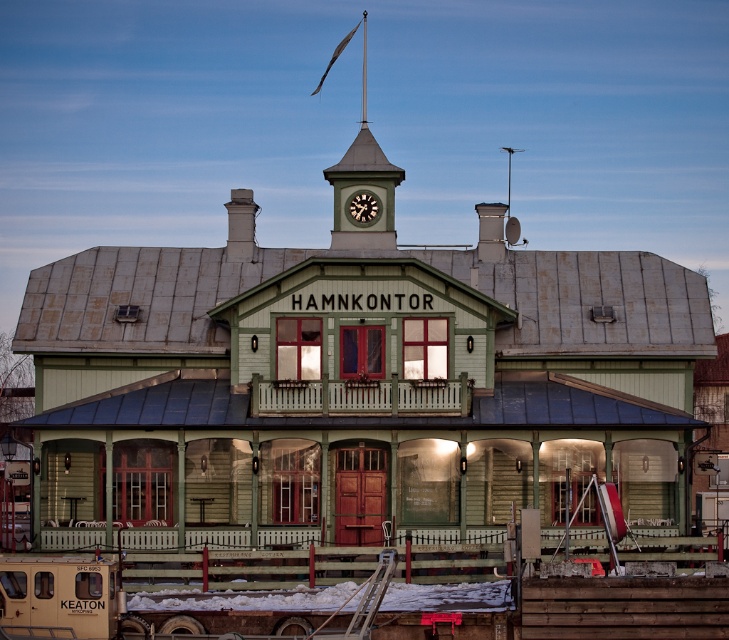
Question: Where is metallic spire at upper center located in relation to matte black clock at upper center in the image?

Choices:
 (A) below
 (B) above

Answer: (B)

Question: Where is metallic spire at upper center located in relation to matte black clock at upper center in the image?

Choices:
 (A) left
 (B) right

Answer: (A)

Question: Which point is closer to the camera?

Choices:
 (A) metallic spire at upper center
 (B) matte black clock at upper center

Answer: (B)

Question: Does metallic spire at upper center have a greater width compared to matte black clock at upper center?

Choices:
 (A) yes
 (B) no

Answer: (A)